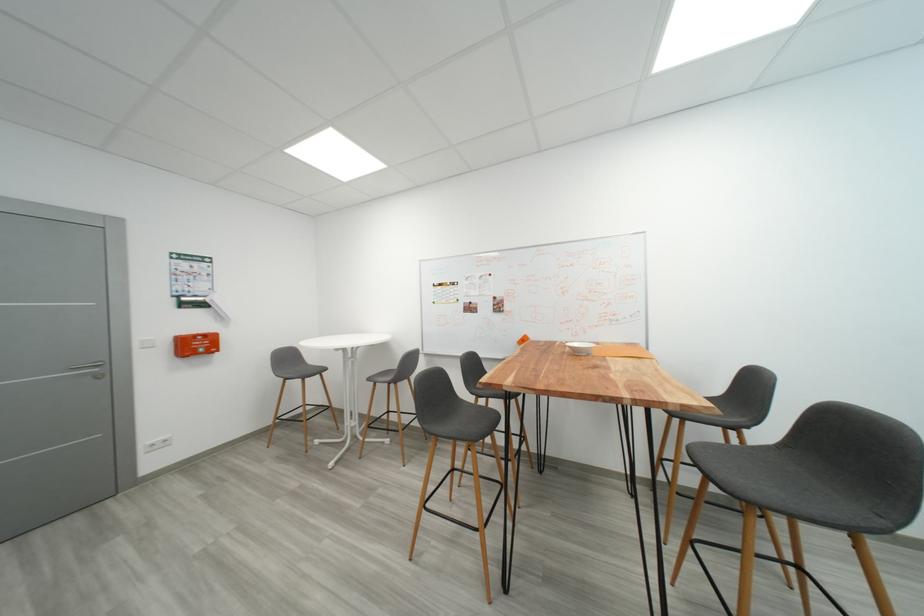
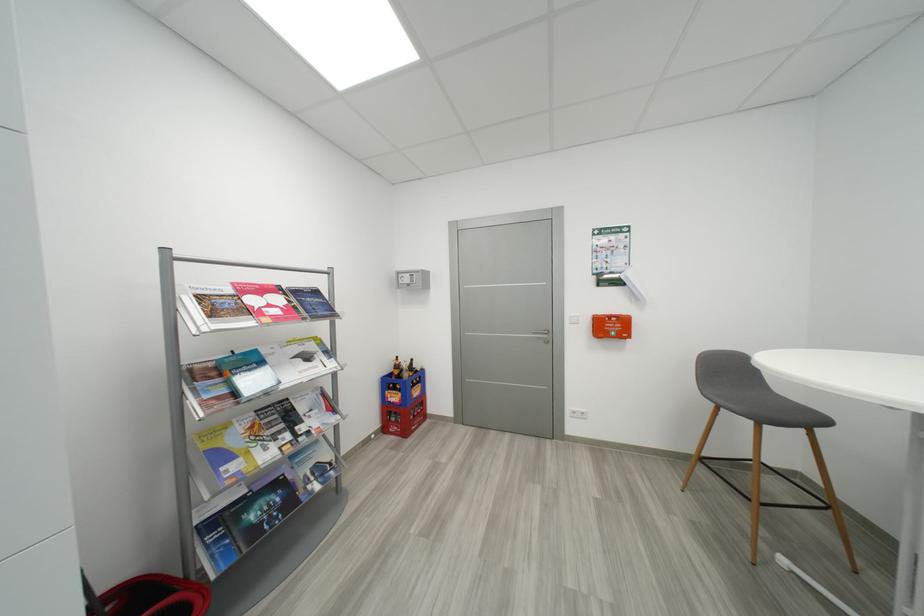
Find the pixel in the second image that matches point (333, 371) in the first image.

(833, 424)